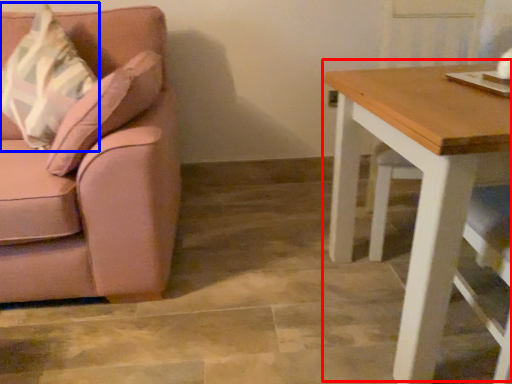
Question: Among these objects, which one is farthest to the camera, table (highlighted by a red box) or throw pillow (highlighted by a blue box)?

Choices:
 (A) table
 (B) throw pillow

Answer: (B)